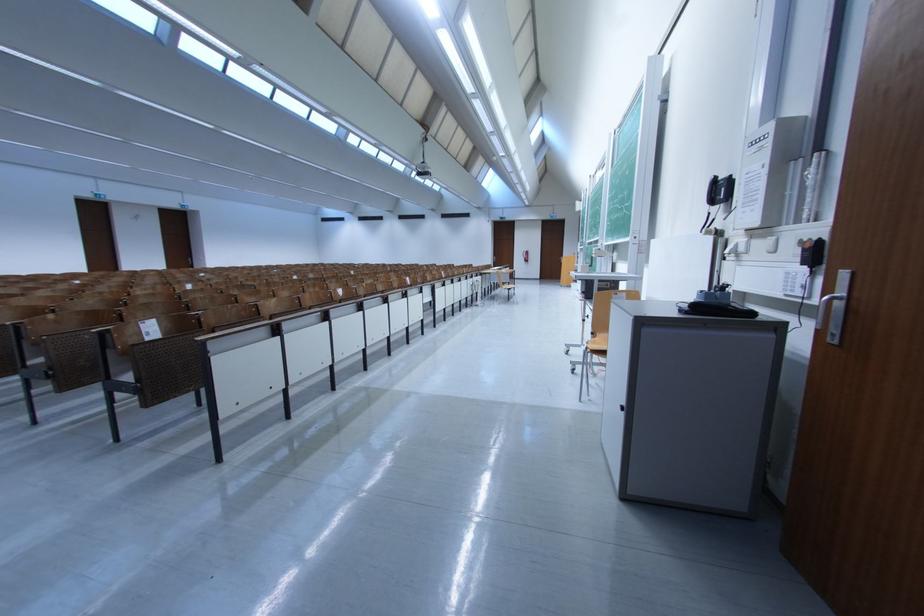
The image size is (924, 616). Describe the element at coordinates (598, 344) in the screenshot. I see `the chair sitting surface` at that location.